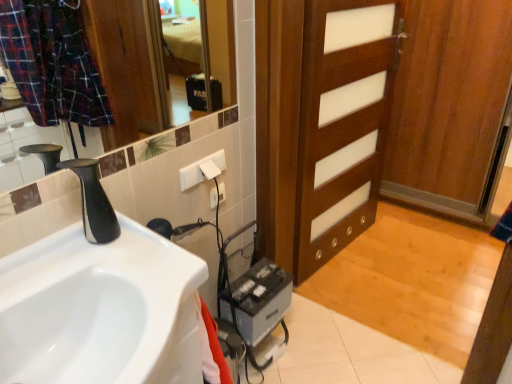
Question: From a real-world perspective, does white glossy sink at lower left sit lower than wooden door at center?

Choices:
 (A) yes
 (B) no

Answer: (B)

Question: From a real-world perspective, does white glossy sink at lower left stand above wooden door at center?

Choices:
 (A) yes
 (B) no

Answer: (A)

Question: Can you confirm if white glossy sink at lower left is wider than wooden door at center?

Choices:
 (A) yes
 (B) no

Answer: (A)

Question: Can you confirm if white glossy sink at lower left is bigger than wooden door at center?

Choices:
 (A) no
 (B) yes

Answer: (A)

Question: Is white glossy sink at lower left shorter than wooden door at center?

Choices:
 (A) yes
 (B) no

Answer: (A)

Question: Is point (216, 193) positioned closer to the camera than point (100, 185)?

Choices:
 (A) closer
 (B) farther

Answer: (B)

Question: Is white plastic electric outlet at upper center, which appears as the second electric outlet when viewed from the front, spatially inside black matte faucet at left, or outside of it?

Choices:
 (A) inside
 (B) outside

Answer: (B)

Question: From their relative heights in the image, would you say white plastic electric outlet at upper center, which appears as the second electric outlet when viewed from the front, is taller or shorter than black matte faucet at left?

Choices:
 (A) tall
 (B) short

Answer: (B)

Question: From the image's perspective, is white plastic electric outlet at upper center, marked as the 1th electric outlet in a back-to-front arrangement, located above or below black matte faucet at left?

Choices:
 (A) below
 (B) above

Answer: (A)

Question: Relative to gray metallic battery at lower center, is wooden door at center in front or behind?

Choices:
 (A) behind
 (B) front

Answer: (B)

Question: Do you think wooden door at center is within gray metallic battery at lower center, or outside of it?

Choices:
 (A) inside
 (B) outside

Answer: (B)

Question: In terms of size, does wooden door at center appear bigger or smaller than gray metallic battery at lower center?

Choices:
 (A) big
 (B) small

Answer: (A)

Question: Would you say wooden door at center is to the left or to the right of gray metallic battery at lower center in the picture?

Choices:
 (A) left
 (B) right

Answer: (B)

Question: Is point (86, 273) positioned closer to the camera than point (98, 240)?

Choices:
 (A) closer
 (B) farther

Answer: (A)

Question: From their relative heights in the image, would you say white glossy sink at lower left is taller or shorter than black matte faucet at left?

Choices:
 (A) short
 (B) tall

Answer: (A)